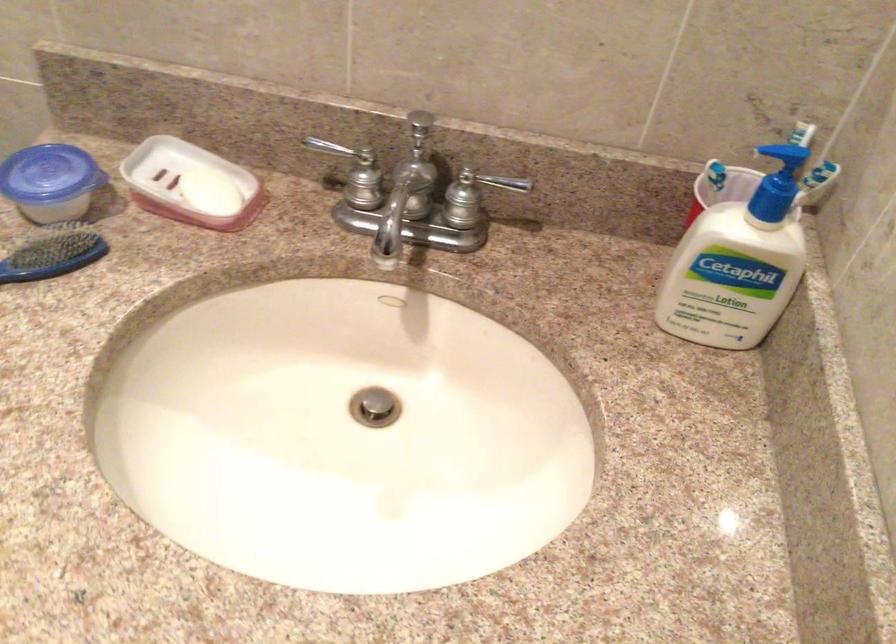
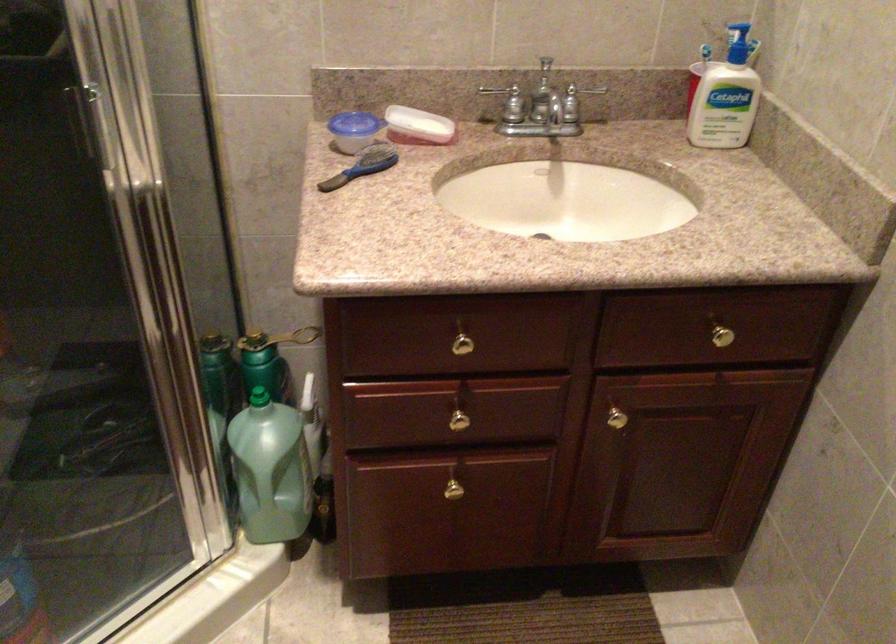
Where in the second image is the point corresponding to [184,187] from the first image?

(418, 126)